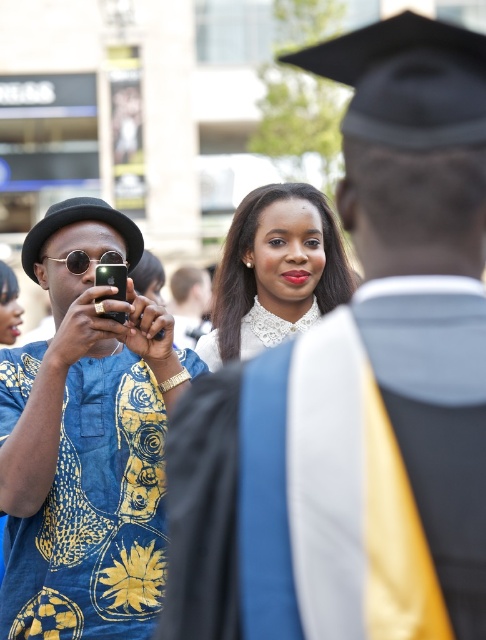
Based on the photo, you are a photographer at a graduation event. You need to capture a photo where both the blue printed shirt at left and the white lace collar at center are clearly visible. Based on their positions, is there any concern about one blocking the other?

The blue printed shirt at left is in front of the white lace collar at center, so it might block part of the white lace collar at center. Adjust the angle or position to ensure both are visible.

You are standing in the graduation ceremony scene. You see the blue printed shirt at left and the white lace collar at center. Which object is closer to the bottom of the image?

The blue printed shirt at left is positioned under the white lace collar at center, so it is closer to the bottom of the image.

You are a photographer at the graduation ceremony. You notice the blue patterned shirt at left and the white lace collar at center in your frame. Which object is located lower in the image?

The blue patterned shirt at left is positioned under the white lace collar at center, so it is located lower in the image.